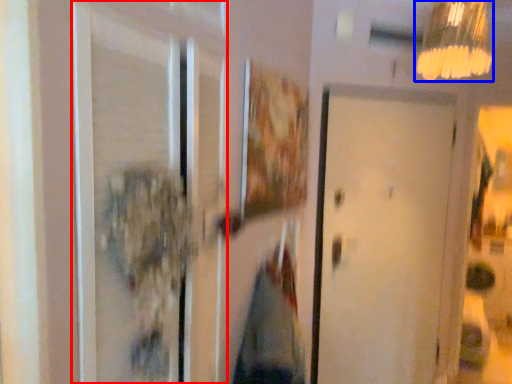
Question: Which of the following is the farthest to the observer, screen door (highlighted by a red box) or lamp (highlighted by a blue box)?

Choices:
 (A) screen door
 (B) lamp

Answer: (B)